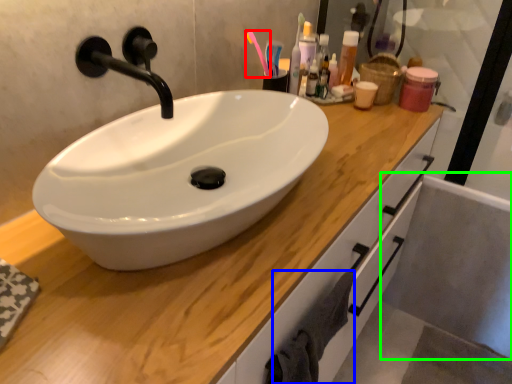
Question: Estimate the real-world distances between objects in this image. Which object is closer to toothbrush (highlighted by a red box), bath towel (highlighted by a blue box) or bath (highlighted by a green box)?

Choices:
 (A) bath towel
 (B) bath

Answer: (A)